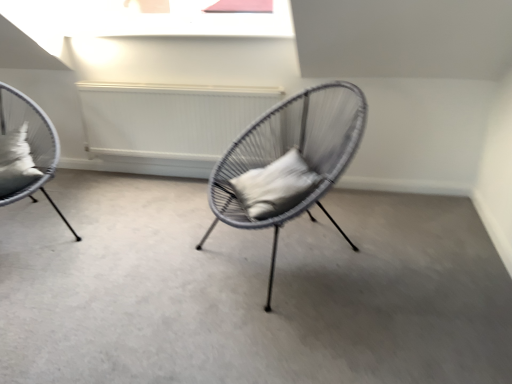
Find the location of a particular element. white soft pillow at left, the second pillow from the right is located at coordinates (16, 162).

Where is `white matte pillow at center, the 2th pillow from the left`? This screenshot has height=384, width=512. white matte pillow at center, the 2th pillow from the left is located at coordinates (275, 186).

I want to click on white textured radiator at center, so click(168, 119).

Which of these two, matte gray chair at center or white soft pillow at left, the second pillow from the right, is thinner?

white soft pillow at left, the second pillow from the right, is thinner.

Does matte gray chair at center turn towards white soft pillow at left, the second pillow from the right?

No, matte gray chair at center is not turned towards white soft pillow at left, the second pillow from the right.

Are matte gray chair at center and white soft pillow at left, the second pillow from the right, beside each other?

matte gray chair at center is not next to white soft pillow at left, the second pillow from the right, and they're not touching.

Is matte gray chair at center positioned in front of white soft pillow at left, which ranks as the first pillow in left-to-right order?

Yes, matte gray chair at center is closer to the viewer.

Is white soft pillow at left, the second pillow from the right, completely or partially outside of white matte pillow at center, placed as the 1th pillow when sorted from right to left?

That's correct, white soft pillow at left, the second pillow from the right, is outside of white matte pillow at center, placed as the 1th pillow when sorted from right to left.

Can you see white soft pillow at left, which ranks as the first pillow in left-to-right order, touching white matte pillow at center, the 2th pillow from the left?

No, white soft pillow at left, which ranks as the first pillow in left-to-right order, is not next to white matte pillow at center, the 2th pillow from the left.

Does white soft pillow at left, the second pillow from the right, appear on the right side of white matte pillow at center, placed as the 1th pillow when sorted from right to left?

No, white soft pillow at left, the second pillow from the right, is not to the right of white matte pillow at center, placed as the 1th pillow when sorted from right to left.

In the image, there is a white soft pillow at left, the second pillow from the right. At what (x,y) coordinates should I click in order to perform the action: click on pillow below it (from a real-world perspective). Please return your answer as a coordinate pair (x, y). This screenshot has height=384, width=512. Looking at the image, I should click on (275, 186).

Which of these two, woven wire chair at center, which is the 2th chair in left-to-right order, or white soft pillow at left, the second pillow from the right, stands taller?

woven wire chair at center, which is the 2th chair in left-to-right order.

Identify the location of the 2nd pillow to the left when counting from the woven wire chair at center, the first chair viewed from the right. Image resolution: width=512 pixels, height=384 pixels. (16, 162).

Could you measure the distance between woven wire chair at center, which is the 2th chair in left-to-right order, and white soft pillow at left, which ranks as the first pillow in left-to-right order?

They are 1.25 meters apart.

From a real-world perspective, is woven wire chair at center, the first chair viewed from the right, physically above white soft pillow at left, the second pillow from the right?

Actually, woven wire chair at center, the first chair viewed from the right, is physically below white soft pillow at left, the second pillow from the right, in the real world.

Does matte grey wicker chair at left, the 1th chair viewed from the left, touch white matte pillow at center, placed as the 1th pillow when sorted from right to left?

No.

Is matte grey wicker chair at left, the second chair viewed from the right, turned away from white matte pillow at center, placed as the 1th pillow when sorted from right to left?

No, white matte pillow at center, placed as the 1th pillow when sorted from right to left, is not at the back of matte grey wicker chair at left, the second chair viewed from the right.

Is matte grey wicker chair at left, the second chair viewed from the right, at the left side of white matte pillow at center, placed as the 1th pillow when sorted from right to left?

Yes, matte grey wicker chair at left, the second chair viewed from the right, is to the left of white matte pillow at center, placed as the 1th pillow when sorted from right to left.

Is white matte pillow at center, the 2th pillow from the left, inside matte grey wicker chair at left, the second chair viewed from the right?

No, white matte pillow at center, the 2th pillow from the left, is not surrounded by matte grey wicker chair at left, the second chair viewed from the right.

Between matte grey wicker chair at left, the 1th chair viewed from the left, and matte gray chair at center, which one has more height?

With more height is matte grey wicker chair at left, the 1th chair viewed from the left.

From a real-world perspective, which is physically above, matte grey wicker chair at left, the 1th chair viewed from the left, or matte gray chair at center?

matte grey wicker chair at left, the 1th chair viewed from the left.

Considering the positions of objects matte grey wicker chair at left, the second chair viewed from the right, and matte gray chair at center in the image provided, who is behind, matte grey wicker chair at left, the second chair viewed from the right, or matte gray chair at center?

matte grey wicker chair at left, the second chair viewed from the right, is more distant.

Is matte grey wicker chair at left, the 1th chair viewed from the left, positioned far away from matte gray chair at center?

No.

Which is nearer, (490, 244) or (5, 115)?

The point (490, 244) is closer to the camera.

From the image's perspective, is matte gray chair at center below matte grey wicker chair at left, the second chair viewed from the right?

Yes, from the image's perspective, matte gray chair at center is below matte grey wicker chair at left, the second chair viewed from the right.

Could you tell me if matte gray chair at center is facing matte grey wicker chair at left, the second chair viewed from the right?

No, matte gray chair at center is not facing towards matte grey wicker chair at left, the second chair viewed from the right.

Could you measure the distance between matte gray chair at center and matte grey wicker chair at left, the 1th chair viewed from the left?

They are 35.96 inches apart.

Can you confirm if white textured radiator at center is smaller than matte grey wicker chair at left, the second chair viewed from the right?

Correct, white textured radiator at center occupies less space than matte grey wicker chair at left, the second chair viewed from the right.

Consider the image. Is there a large distance between white textured radiator at center and matte grey wicker chair at left, the 1th chair viewed from the left?

No, white textured radiator at center is not far from matte grey wicker chair at left, the 1th chair viewed from the left.

In order to click on radiator located underneath the matte grey wicker chair at left, the 1th chair viewed from the left (from a real-world perspective) in this screenshot , I will do `click(168, 119)`.

Could you measure the distance between white textured radiator at center and matte grey wicker chair at left, the second chair viewed from the right?

75.20 centimeters.

Locate an element on the screen. concrete in front of the white soft pillow at left, the second pillow from the right is located at coordinates (247, 290).

You are a GUI agent. You are given a task and a screenshot of the screen. Output one action in this format:
    pyautogui.click(x=<x>, y=<y>)
    Task: Click on the pillow beneath the white soft pillow at left, which ranks as the first pillow in left-to-right order (from a real-world perspective)
    Image resolution: width=512 pixels, height=384 pixels.
    Given the screenshot: What is the action you would take?
    pyautogui.click(x=275, y=186)

Based on their spatial positions, is woven wire chair at center, which is the 2th chair in left-to-right order, or matte grey wicker chair at left, the 1th chair viewed from the left, closer to white matte pillow at center, the 2th pillow from the left?

woven wire chair at center, which is the 2th chair in left-to-right order.

Which object lies further to the anchor point matte gray chair at center, white soft pillow at left, the second pillow from the right, or matte grey wicker chair at left, the second chair viewed from the right?

white soft pillow at left, the second pillow from the right, is positioned further to the anchor matte gray chair at center.

Based on their spatial positions, is white matte pillow at center, placed as the 1th pillow when sorted from right to left, or woven wire chair at center, the first chair viewed from the right, further from matte gray chair at center?

white matte pillow at center, placed as the 1th pillow when sorted from right to left, lies further to matte gray chair at center than the other object.

Considering their positions, is white matte pillow at center, the 2th pillow from the left, positioned further to white soft pillow at left, which ranks as the first pillow in left-to-right order, than matte grey wicker chair at left, the 1th chair viewed from the left?

white matte pillow at center, the 2th pillow from the left, lies further to white soft pillow at left, which ranks as the first pillow in left-to-right order, than the other object.

Looking at the image, which one is located closer to matte grey wicker chair at left, the second chair viewed from the right, woven wire chair at center, which is the 2th chair in left-to-right order, or white matte pillow at center, placed as the 1th pillow when sorted from right to left?

white matte pillow at center, placed as the 1th pillow when sorted from right to left.

Looking at the image, which one is located further to matte gray chair at center, white textured radiator at center or woven wire chair at center, which is the 2th chair in left-to-right order?

white textured radiator at center is positioned further to the anchor matte gray chair at center.

Considering their positions, is woven wire chair at center, the first chair viewed from the right, positioned further to matte grey wicker chair at left, the second chair viewed from the right, than matte gray chair at center?

woven wire chair at center, the first chair viewed from the right, is further to matte grey wicker chair at left, the second chair viewed from the right.

Estimate the real-world distances between objects in this image. Which object is closer to matte gray chair at center, woven wire chair at center, the first chair viewed from the right, or white matte pillow at center, placed as the 1th pillow when sorted from right to left?

woven wire chair at center, the first chair viewed from the right, is positioned closer to the anchor matte gray chair at center.

Where is `radiator between white soft pillow at left, the second pillow from the right, and white matte pillow at center, the 2th pillow from the left, in the horizontal direction`? Image resolution: width=512 pixels, height=384 pixels. radiator between white soft pillow at left, the second pillow from the right, and white matte pillow at center, the 2th pillow from the left, in the horizontal direction is located at coordinates (168, 119).

This screenshot has width=512, height=384. I want to click on pillow between matte grey wicker chair at left, the second chair viewed from the right, and matte gray chair at center, so click(16, 162).

The height and width of the screenshot is (384, 512). What are the coordinates of `radiator between matte grey wicker chair at left, the 1th chair viewed from the left, and white matte pillow at center, the 2th pillow from the left, in the horizontal direction` in the screenshot? It's located at click(168, 119).

At what (x,y) coordinates should I click in order to perform the action: click on pillow located between matte grey wicker chair at left, the second chair viewed from the right, and white textured radiator at center in the left-right direction. Please return your answer as a coordinate pair (x, y). The image size is (512, 384). Looking at the image, I should click on (16, 162).